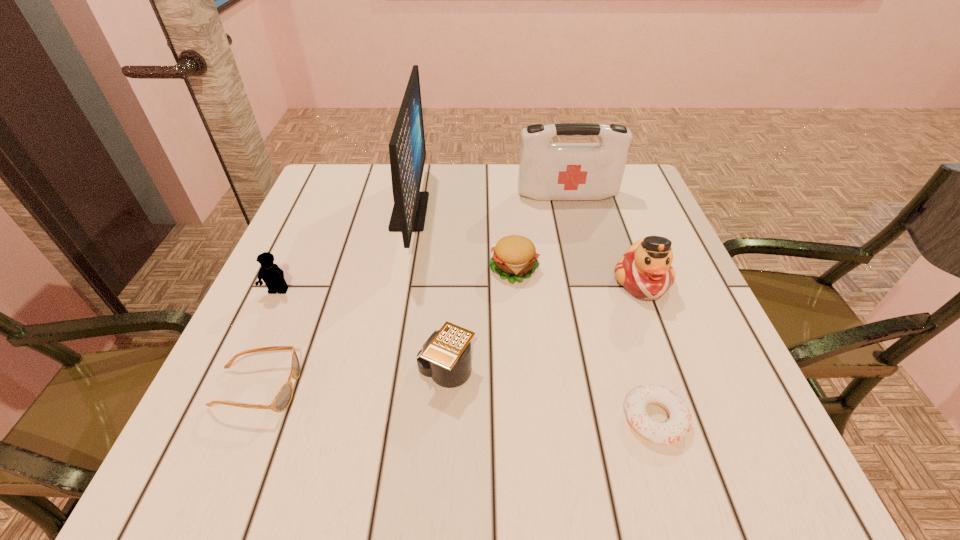
Find the location of a particular element. Image resolution: width=960 pixels, height=540 pixels. vacant space at the far left corner of the desktop is located at coordinates (372, 168).

Image resolution: width=960 pixels, height=540 pixels. I want to click on free space at the far right corner of the desktop, so click(x=625, y=168).

This screenshot has height=540, width=960. I want to click on vacant space at the near right corner of the desktop, so click(780, 476).

Find the location of a particular element. The height and width of the screenshot is (540, 960). vacant space that is in between the calculator and the seventh shortest object is located at coordinates (507, 283).

Find the location of `empty space that is in between the sunglasses and the fourth tallest object`. empty space that is in between the sunglasses and the fourth tallest object is located at coordinates (268, 340).

You are a GUI agent. You are given a task and a screenshot of the screen. Output one action in this format:
    pyautogui.click(x=<x>, y=<y>)
    Task: Click on the empty space that is in between the hamburger and the doughnut
    Image resolution: width=960 pixels, height=540 pixels.
    Given the screenshot: What is the action you would take?
    pyautogui.click(x=585, y=344)

At what (x,y) coordinates should I click in order to perform the action: click on vacant point located between the calculator and the doughnut. Please return your answer as a coordinate pair (x, y). The width and height of the screenshot is (960, 540). Looking at the image, I should click on (551, 395).

At what (x,y) coordinates should I click in order to perform the action: click on vacant area that lies between the second tallest object and the sixth object from right to left. Please return your answer as a coordinate pair (x, y). This screenshot has height=540, width=960. Looking at the image, I should click on (489, 204).

Identify the location of empty space that is in between the second tallest object and the tallest object. click(x=489, y=204).

Image resolution: width=960 pixels, height=540 pixels. In order to click on vacant area between the second shortest object and the fourth tallest object in this screenshot , I will do `click(268, 340)`.